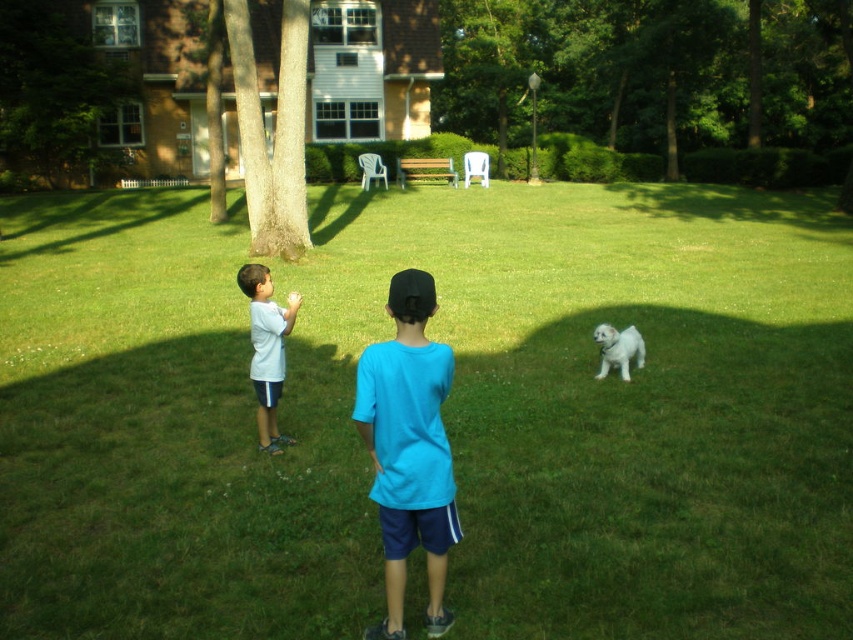
Does green grass at center appear over green leafy tree at upper left?

Incorrect, green grass at center is not positioned above green leafy tree at upper left.

Can you confirm if green grass at center is smaller than green leafy tree at upper left?

Actually, green grass at center might be larger than green leafy tree at upper left.

Who is more distant from viewer, (48, 496) or (65, 131)?

The point (65, 131) is more distant.

This screenshot has width=853, height=640. Find the location of `green grass at center`. green grass at center is located at coordinates (444, 416).

Does blue cotton shirt at center have a lesser height compared to brown rough bark tree at left?

Yes, blue cotton shirt at center is shorter than brown rough bark tree at left.

In order to click on blue cotton shirt at center in this screenshot , I will do `click(408, 449)`.

Between green grass at center and white matte shirt at left, which one has more height?

With more height is green grass at center.

Locate an element on the screen. The width and height of the screenshot is (853, 640). green grass at center is located at coordinates (444, 416).

What are the coordinates of `green grass at center` in the screenshot? It's located at (444, 416).